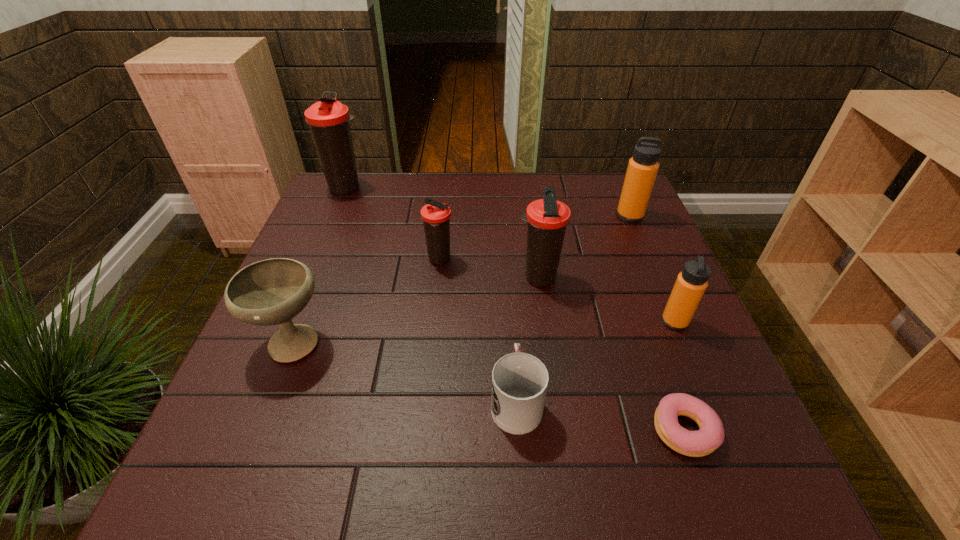
At what (x,y) coordinates should I click in order to perform the action: click on free location located 0.230m on the front of the chalice. Please return your answer as a coordinate pair (x, y). This screenshot has width=960, height=540. Looking at the image, I should click on (234, 489).

This screenshot has height=540, width=960. In order to click on vacant space situated 0.400m on the side of the red cup where the handle is located in this screenshot , I will do `click(506, 246)`.

The image size is (960, 540). Identify the location of vacant point located 0.360m on the side of the red cup where the handle is located. (506, 255).

At what (x,y) coordinates should I click in order to perform the action: click on vacant region located on the side of the red cup where the handle is located. Please return your answer as a coordinate pair (x, y). Image resolution: width=960 pixels, height=540 pixels. Looking at the image, I should click on (511, 318).

Locate an element on the screen. vacant space located on the back of the doughnut is located at coordinates (659, 359).

Where is `object at the near edge`? object at the near edge is located at coordinates (710, 436).

Find the location of a particular element. thermos bottle present at the left edge is located at coordinates (328, 119).

Where is `chalice positioned at the left edge`? The image size is (960, 540). chalice positioned at the left edge is located at coordinates (269, 292).

In order to click on doughnut at the right edge in this screenshot , I will do pos(710,436).

Locate an element on the screen. This screenshot has width=960, height=540. object at the far left corner is located at coordinates (328, 119).